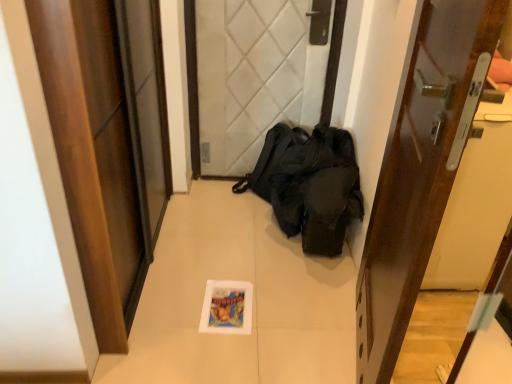
I want to click on vacant space to the right of wooden door at left, placed as the first door when sorted from left to right, so click(234, 272).